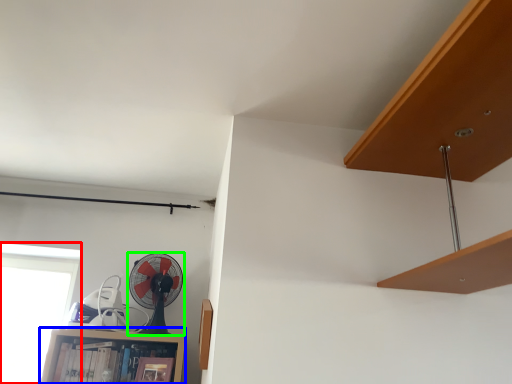
Question: Which is nearer to the window (highlighted by a red box)? cabinet (highlighted by a blue box) or mechanical fan (highlighted by a green box).

Choices:
 (A) cabinet
 (B) mechanical fan

Answer: (A)